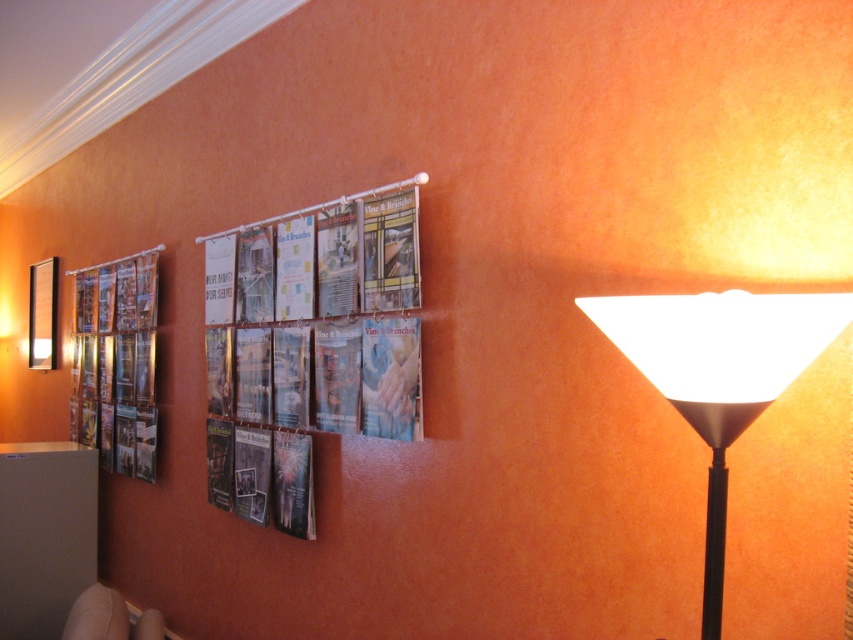
You are standing in the room shown in the image and want to turn on the white matte floor lamp at right. Based on its position, where should you walk to reach it?

The white matte floor lamp at right is located at point 0.584 on the x axis and 0.844 on the y axis. You should walk towards those coordinates to reach it.

You are standing in the room and want to know which object is taller between the white matte floor lamp at right and the metallic glossy poster at left. Can you determine this based on their positions?

The white matte floor lamp at right has a lesser height compared to the metallic glossy poster at left, so the metallic glossy poster at left is taller.

You are standing in the room shown in the image. There are two points marked on the wall. The first point is at coordinates point (x=112, y=394) and the second point is at point (x=32, y=342). Which point is closer to you?

Point (x=112, y=394) is in front of point (x=32, y=342), so it is closer to you.